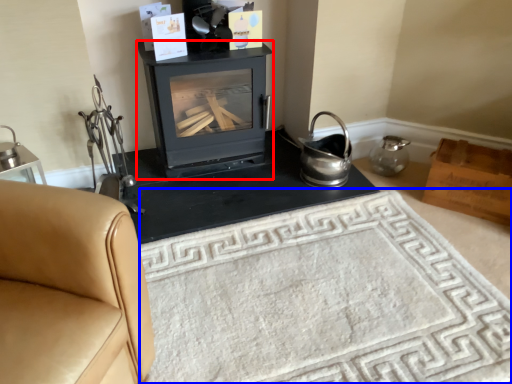
Question: Which point is further to the camera, wood burning stove (highlighted by a red box) or doormat (highlighted by a blue box)?

Choices:
 (A) wood burning stove
 (B) doormat

Answer: (A)